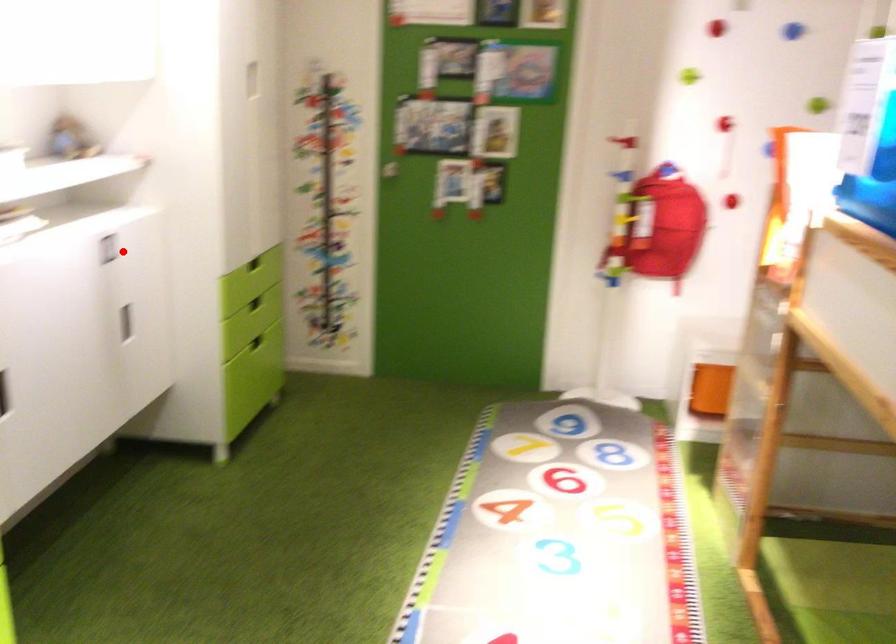
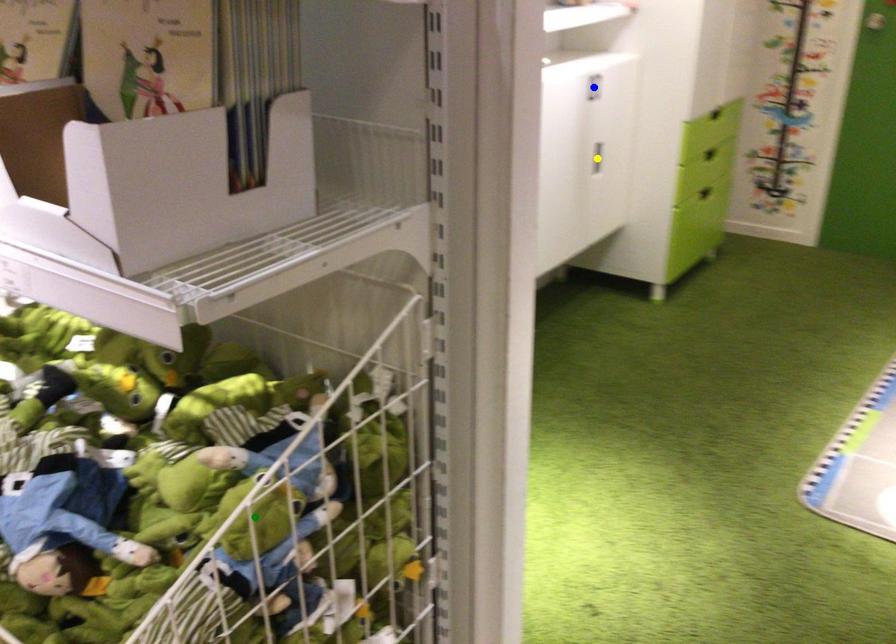
Question: I am providing you with two images of the same scene from different viewpoints. A red point is marked on the first image. You are given multiple points on the second image. Which point in image 2 represents the same 3d spot as the red point in image 1?

Choices:
 (A) green point
 (B) blue point
 (C) yellow point

Answer: (B)